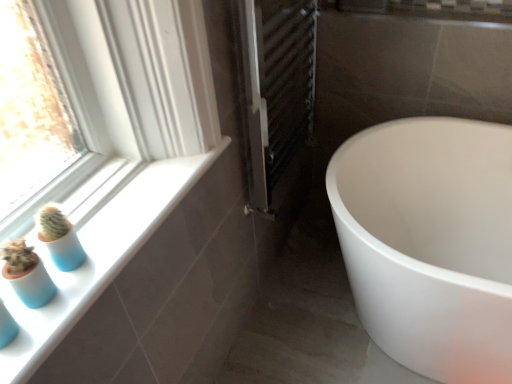
Question: Is white glossy window sill at lower left wider or thinner than white glossy tub at lower right?

Choices:
 (A) wide
 (B) thin

Answer: (B)

Question: From a real-world perspective, is white glossy window sill at lower left above or below white glossy tub at lower right?

Choices:
 (A) below
 (B) above

Answer: (B)

Question: Estimate the real-world distances between objects in this image. Which object is closer to the blue matte glass vase at lower left?

Choices:
 (A) metallic silver radiator at center
 (B) white glossy window sill at lower left
 (C) white glossy tub at lower right

Answer: (B)

Question: Which is nearer to the white glossy window sill at lower left?

Choices:
 (A) blue matte glass vase at lower left
 (B) white glossy tub at lower right
 (C) metallic silver radiator at center

Answer: (A)